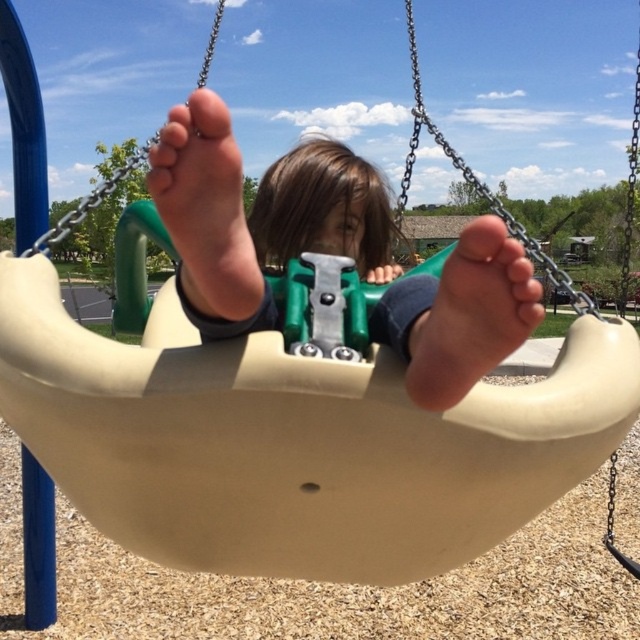
Question: Which of the following is the closest to the observer?

Choices:
 (A) matte beige foot at center
 (B) pink soft skin at center
 (C) beige plastic swing at center

Answer: (C)

Question: Which point is farther to the camera?

Choices:
 (A) beige plastic swing at center
 (B) matte beige foot at center
 (C) pink soft skin at center

Answer: (B)

Question: Is beige plastic swing at center wider than matte beige foot at center?

Choices:
 (A) no
 (B) yes

Answer: (B)

Question: Which of these objects is positioned farthest from the matte beige foot at center?

Choices:
 (A) pink soft skin at center
 (B) beige plastic swing at center

Answer: (B)

Question: Is beige plastic swing at center bigger than matte beige foot at center?

Choices:
 (A) no
 (B) yes

Answer: (B)

Question: Does beige plastic swing at center appear under matte beige foot at center?

Choices:
 (A) no
 (B) yes

Answer: (A)